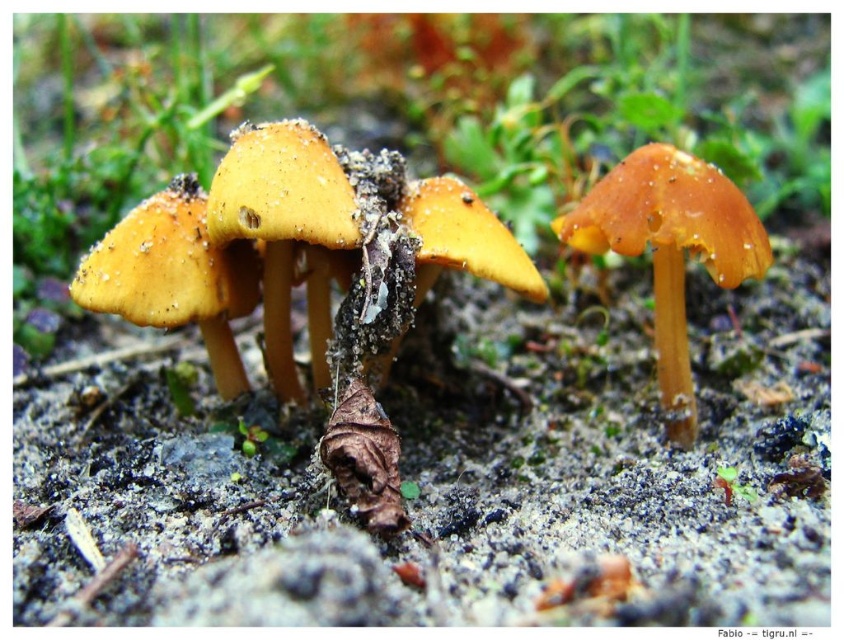
Question: Is yellow matte mushroom at center bigger than orange matte mushroom at center?

Choices:
 (A) no
 (B) yes

Answer: (A)

Question: Which point is closer to the camera?

Choices:
 (A) (626, 202)
 (B) (141, 250)
 (C) (272, 227)

Answer: (C)

Question: Is orange matte mushroom at center further to camera compared to matte yellow mushroom at left?

Choices:
 (A) no
 (B) yes

Answer: (A)

Question: Among these objects, which one is farthest from the camera?

Choices:
 (A) orange matte mushroom at center
 (B) yellow matte mushroom at center

Answer: (B)

Question: Observing the image, what is the correct spatial positioning of orange matte mushroom at center in reference to matte yellow mushroom at left?

Choices:
 (A) left
 (B) right

Answer: (B)

Question: Which object is the closest to the matte yellow mushroom at left?

Choices:
 (A) yellow matte mushroom at center
 (B) orange matte mushroom at center

Answer: (A)